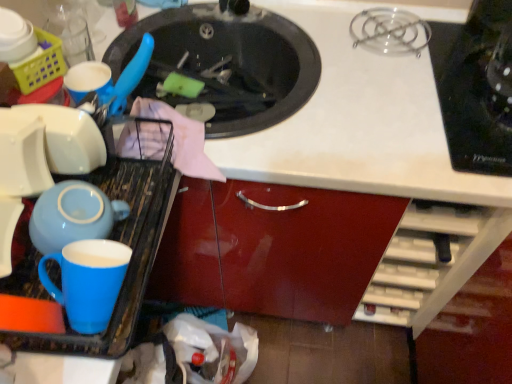
Question: Is black glossy sink at upper center placed right next to black glass cooktop at upper right?

Choices:
 (A) yes
 (B) no

Answer: (B)

Question: Is black glossy sink at upper center shorter than black glass cooktop at upper right?

Choices:
 (A) no
 (B) yes

Answer: (A)

Question: Is black glossy sink at upper center at the left side of black glass cooktop at upper right?

Choices:
 (A) yes
 (B) no

Answer: (A)

Question: From the image's perspective, does black glossy sink at upper center appear lower than black glass cooktop at upper right?

Choices:
 (A) yes
 (B) no

Answer: (B)

Question: From the image's perspective, is black glossy sink at upper center located above black glass cooktop at upper right?

Choices:
 (A) no
 (B) yes

Answer: (B)

Question: Can you confirm if black glossy sink at upper center is taller than black glass cooktop at upper right?

Choices:
 (A) no
 (B) yes

Answer: (B)

Question: Would you say plastic yellow basket at upper left contains black glossy sink at upper center?

Choices:
 (A) yes
 (B) no

Answer: (B)

Question: Is plastic yellow basket at upper left to the right of black glossy sink at upper center from the viewer's perspective?

Choices:
 (A) no
 (B) yes

Answer: (A)

Question: Is plastic yellow basket at upper left further to the viewer compared to black glossy sink at upper center?

Choices:
 (A) no
 (B) yes

Answer: (A)

Question: Is there a large distance between plastic yellow basket at upper left and black glossy sink at upper center?

Choices:
 (A) no
 (B) yes

Answer: (A)

Question: Is plastic yellow basket at upper left positioned before black glossy sink at upper center?

Choices:
 (A) yes
 (B) no

Answer: (A)

Question: Is the surface of plastic yellow basket at upper left in direct contact with black glossy sink at upper center?

Choices:
 (A) no
 (B) yes

Answer: (A)

Question: Considering the relative sizes of blue glossy mug at left and plastic yellow basket at upper left in the image provided, is blue glossy mug at left taller than plastic yellow basket at upper left?

Choices:
 (A) no
 (B) yes

Answer: (A)